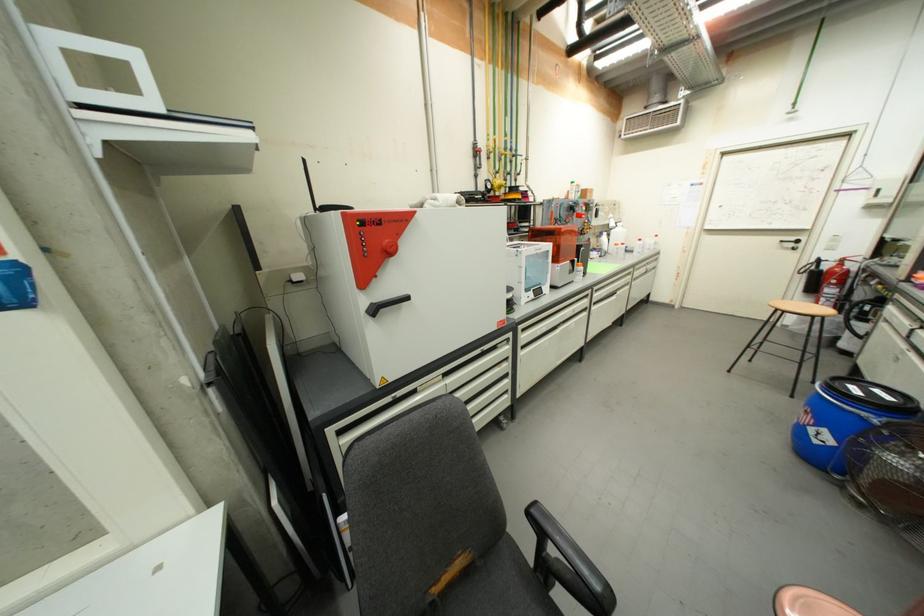
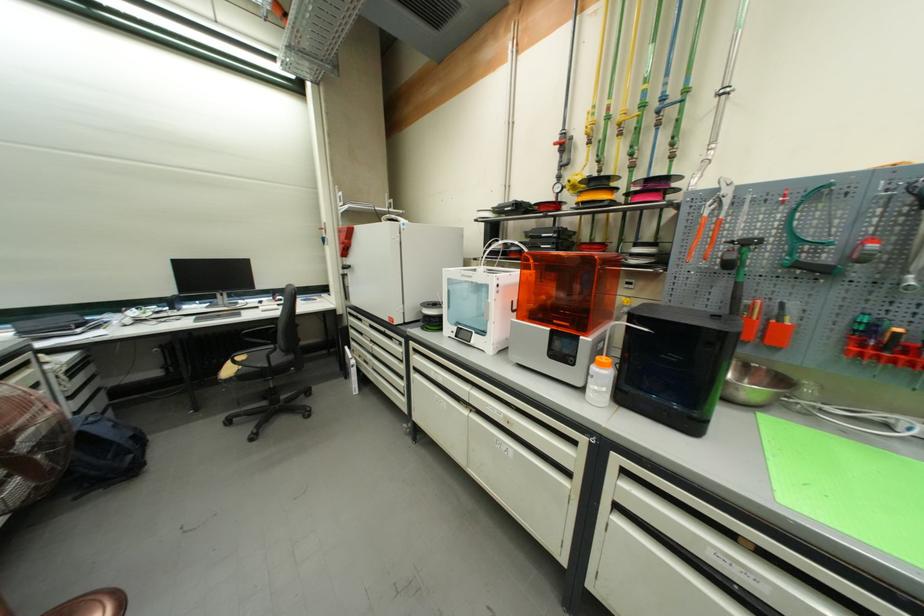
In the second image, find the point that corresponds to [482,177] in the first image.

(566, 179)